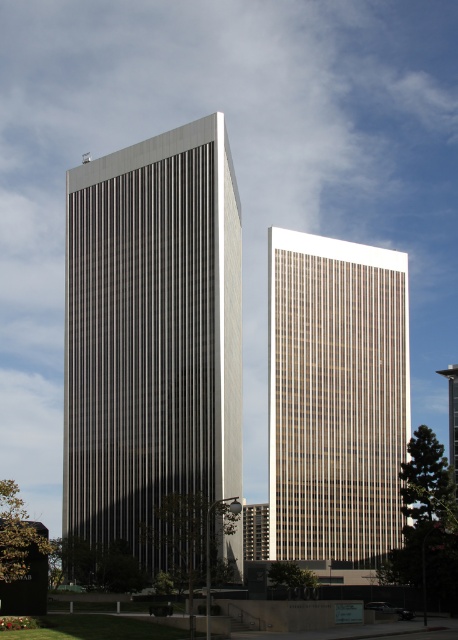
You are standing in the foreground of the image and want to take a photo of both the white textured building at center and the beige glass tower at center. Which building will appear closer to the camera in your photo?

The white textured building at center will appear closer to the camera in your photo because it is positioned in front of the beige glass tower at center.

You are standing in the foreground of the image and want to walk towards the beige glass tower at center. Which direction should you head to reach it from the white textured building at center?

To reach the beige glass tower at center from the white textured building at center, you should head to the right since the white textured building at center is located to the left of the beige glass tower at center.